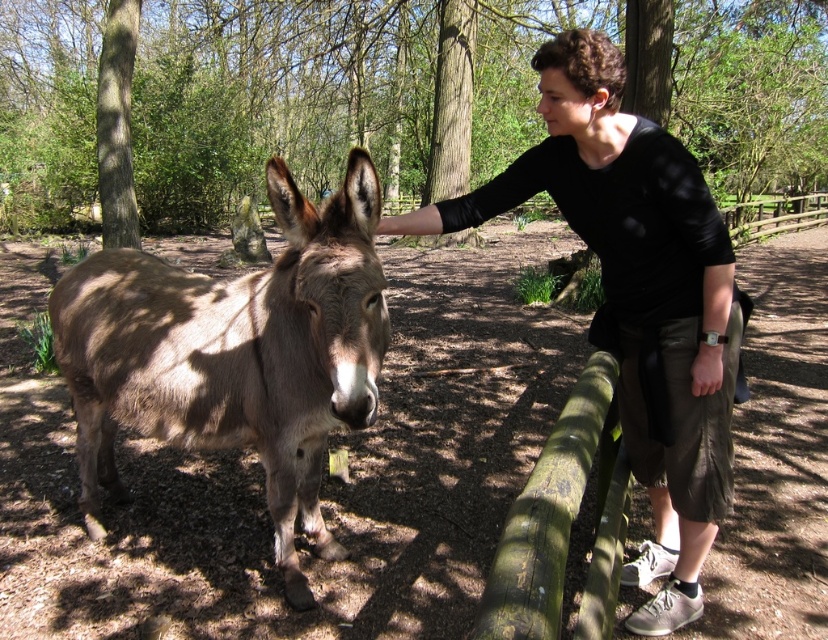
Question: Which point is closer to the camera taking this photo?

Choices:
 (A) (121, 291)
 (B) (653, 259)

Answer: (B)

Question: Among these objects, which one is nearest to the camera?

Choices:
 (A) brown textured donkey at center
 (B) black cotton shirt at upper right

Answer: (A)

Question: Is brown textured donkey at center closer to camera compared to black cotton shirt at upper right?

Choices:
 (A) no
 (B) yes

Answer: (B)

Question: Is brown textured donkey at center thinner than black cotton shirt at upper right?

Choices:
 (A) no
 (B) yes

Answer: (A)

Question: Is brown textured donkey at center further to camera compared to black cotton shirt at upper right?

Choices:
 (A) no
 (B) yes

Answer: (A)